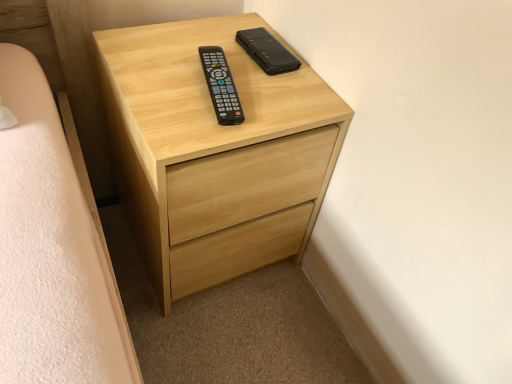
The height and width of the screenshot is (384, 512). Find the location of `free space in front of black plastic remote at center, the second control viewed from the back`. free space in front of black plastic remote at center, the second control viewed from the back is located at coordinates click(195, 135).